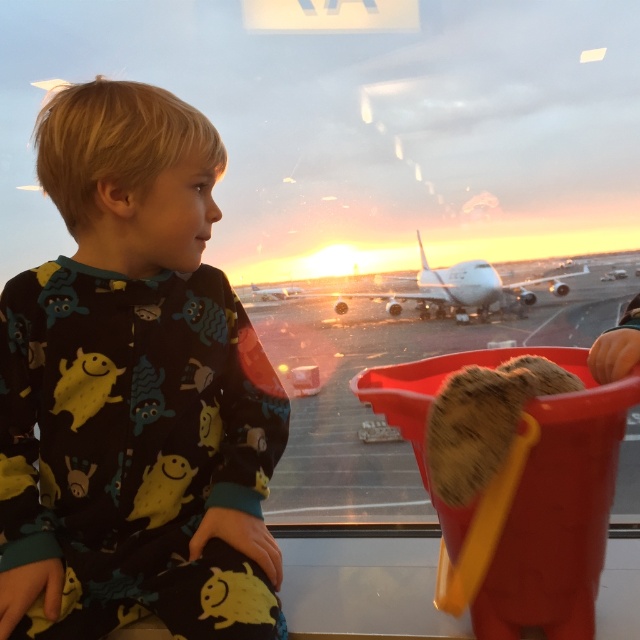
You are a parent looking for your child. You see the black cotton pajamas at center and the white matte airplane at center. Which object is closer to the bottom of the image?

The black cotton pajamas at center is below the white matte airplane at center, so it is closer to the bottom of the image.

You are a photographer trying to capture a clear shot of the black cotton pajamas at center and the white matte airplane at center. Which object should you focus on first to ensure both are in focus?

You should focus on the black cotton pajamas at center first since it is closer to the viewer than the white matte airplane at center, allowing for better depth of field coverage for both objects.

You are a parent looking for your child who is wearing black cotton pajamas at center. You see a point at coordinates [132,392] in the image. Is this point on your child?

Yes, the point at [132,392] is on the black cotton pajamas at center, so it is on your child.